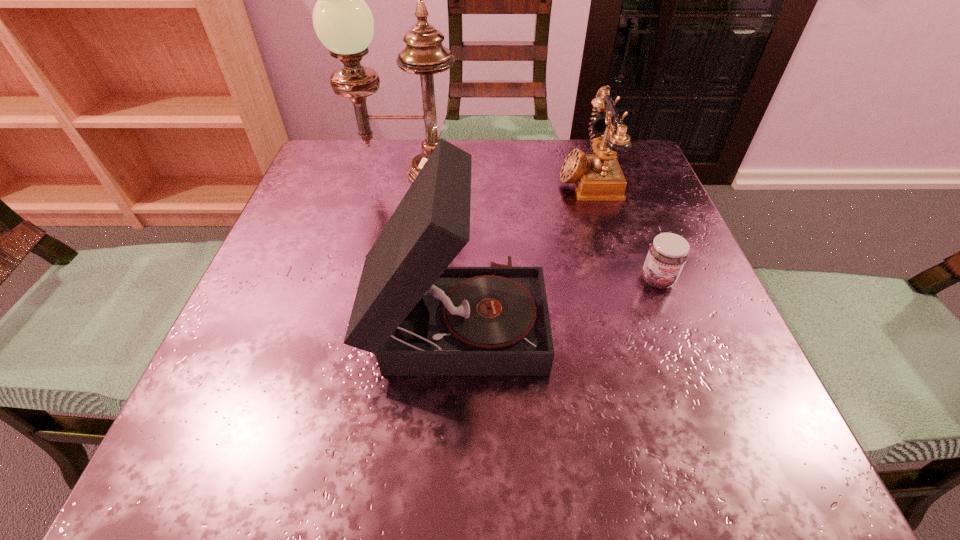
Find the location of `oil lamp present at the far edge`. oil lamp present at the far edge is located at coordinates (342, 20).

Identify the location of telephone that is at the far edge. This screenshot has width=960, height=540. (598, 177).

The image size is (960, 540). In order to click on object that is at the left edge in this screenshot , I will do 342,20.

I want to click on telephone that is at the right edge, so click(598, 177).

In order to click on jam situated at the right edge in this screenshot , I will do `click(667, 254)`.

Find the location of a particular element. object present at the far left corner is located at coordinates (342, 20).

Identify the location of object situated at the far right corner. This screenshot has height=540, width=960. (598, 177).

In the image, there is a desktop. Find the location of `free space at the far edge`. free space at the far edge is located at coordinates (541, 146).

Find the location of a particular element. The image size is (960, 540). vacant space at the near edge is located at coordinates (544, 423).

Where is `vacant space at the left edge of the desktop`? The height and width of the screenshot is (540, 960). vacant space at the left edge of the desktop is located at coordinates (276, 329).